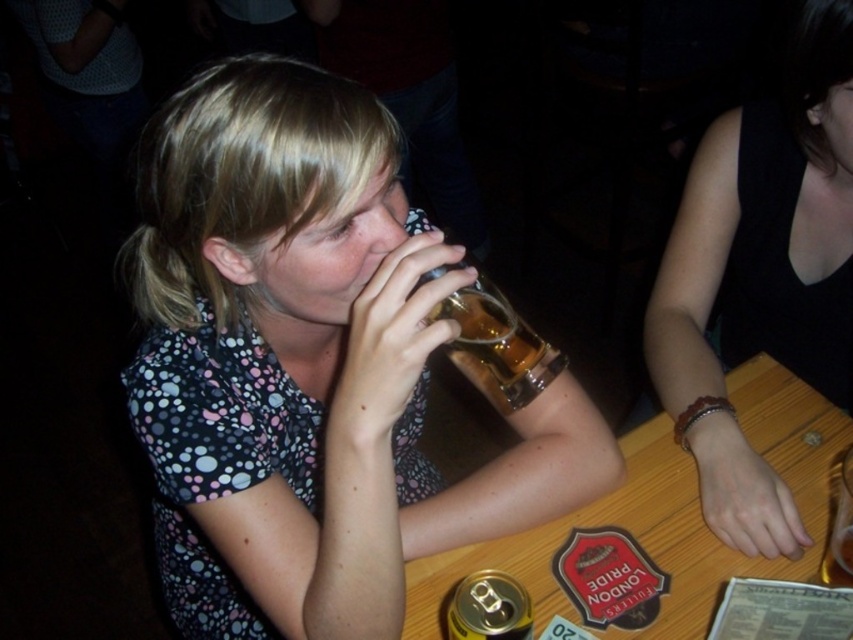
Is point (517, 595) farther from viewer compared to point (840, 532)?

That is False.

Where is `gold metallic can at lower center`? This screenshot has width=853, height=640. gold metallic can at lower center is located at coordinates (488, 608).

Can you confirm if matte glass mug at center is wider than black matte tank top at upper right?

Yes, matte glass mug at center is wider than black matte tank top at upper right.

Can you confirm if matte glass mug at center is positioned above black matte tank top at upper right?

No, matte glass mug at center is not above black matte tank top at upper right.

Does point (178, 314) come in front of point (700, 284)?

Yes, point (178, 314) is in front of point (700, 284).

The width and height of the screenshot is (853, 640). Identify the location of matte glass mug at center. (306, 365).

In the scene shown: Can you confirm if black matte tank top at upper right is shorter than gold metallic can at lower center?

Incorrect, black matte tank top at upper right's height does not fall short of gold metallic can at lower center's.

Is black matte tank top at upper right below gold metallic can at lower center?

Incorrect, black matte tank top at upper right is not positioned below gold metallic can at lower center.

At what (x,y) coordinates should I click in order to perform the action: click on black matte tank top at upper right. Please return your answer as a coordinate pair (x, y). Looking at the image, I should click on (761, 275).